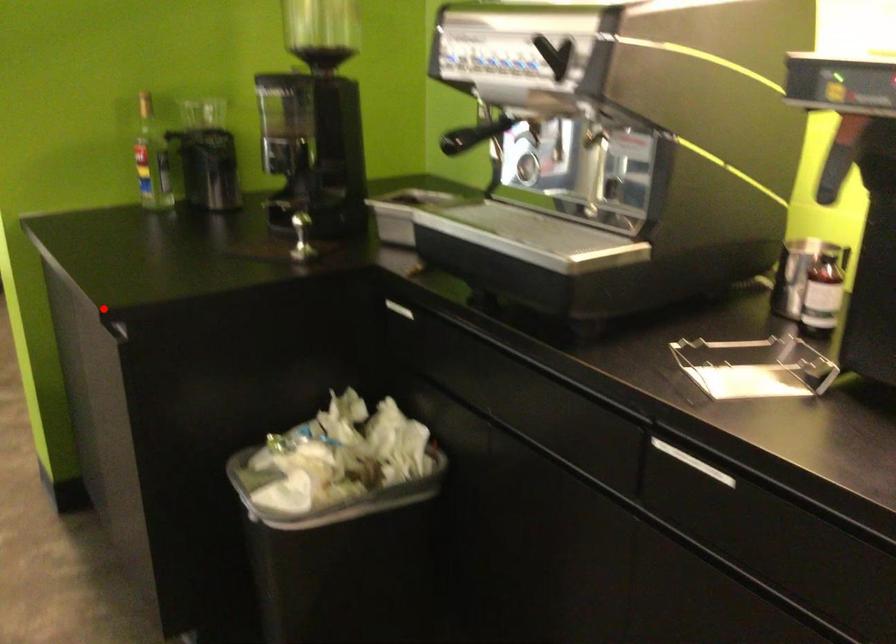
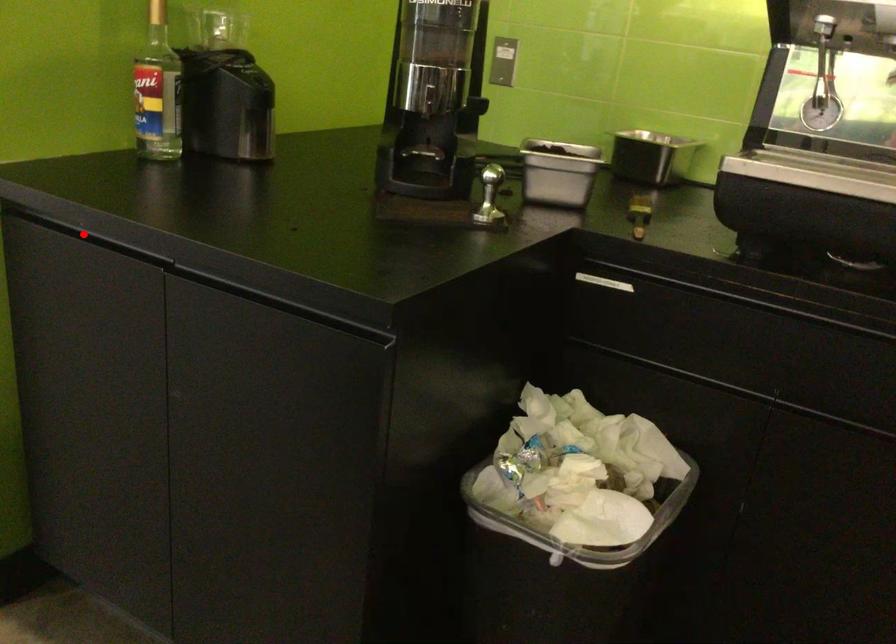
I am providing you with two images of the same scene from different viewpoints. A red point is marked on the first image and another point is marked on the second image. Is the marked point in image1 the same physical position as the marked point in image2?

No